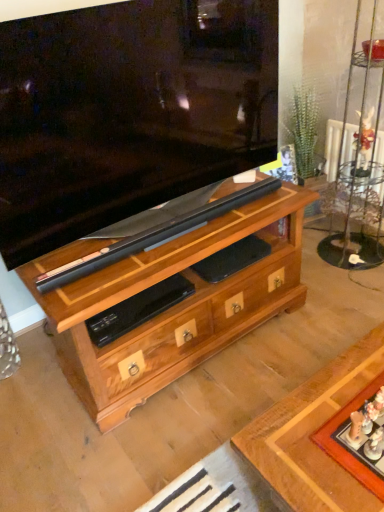
Question: From a real-world perspective, is wooden chest of drawers at center positioned under wooden board game at lower right based on gravity?

Choices:
 (A) yes
 (B) no

Answer: (A)

Question: Can you confirm if wooden chest of drawers at center is positioned to the right of wooden board game at lower right?

Choices:
 (A) yes
 (B) no

Answer: (B)

Question: Can you confirm if wooden chest of drawers at center is wider than wooden board game at lower right?

Choices:
 (A) no
 (B) yes

Answer: (B)

Question: Can you confirm if wooden chest of drawers at center is smaller than wooden board game at lower right?

Choices:
 (A) yes
 (B) no

Answer: (B)

Question: Considering the relative sizes of wooden chest of drawers at center and wooden board game at lower right in the image provided, is wooden chest of drawers at center thinner than wooden board game at lower right?

Choices:
 (A) no
 (B) yes

Answer: (A)

Question: Can you confirm if wooden chest of drawers at center is positioned to the left of wooden board game at lower right?

Choices:
 (A) no
 (B) yes

Answer: (B)

Question: Does wooden board game at lower right have a greater height compared to wooden chest of drawers at center?

Choices:
 (A) yes
 (B) no

Answer: (B)

Question: From the image's perspective, would you say wooden board game at lower right is positioned over wooden chest of drawers at center?

Choices:
 (A) yes
 (B) no

Answer: (B)

Question: Can you confirm if wooden board game at lower right is bigger than wooden chest of drawers at center?

Choices:
 (A) no
 (B) yes

Answer: (A)

Question: Considering the relative sizes of wooden board game at lower right and wooden chest of drawers at center in the image provided, is wooden board game at lower right smaller than wooden chest of drawers at center?

Choices:
 (A) yes
 (B) no

Answer: (A)

Question: Is wooden board game at lower right closer to camera compared to wooden chest of drawers at center?

Choices:
 (A) yes
 (B) no

Answer: (A)

Question: Is the surface of wooden board game at lower right in direct contact with wooden chest of drawers at center?

Choices:
 (A) yes
 (B) no

Answer: (B)

Question: In the image, is wooden board game at lower right positioned in front of or behind wooden chest of drawers at center?

Choices:
 (A) behind
 (B) front

Answer: (B)